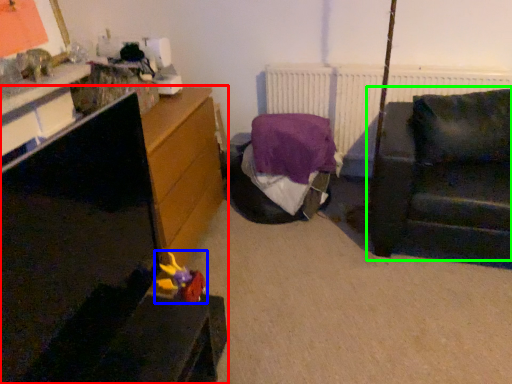
Question: Which is nearer to the furniture (highlighted by a red box)? toy (highlighted by a blue box) or studio couch (highlighted by a green box).

Choices:
 (A) toy
 (B) studio couch

Answer: (A)